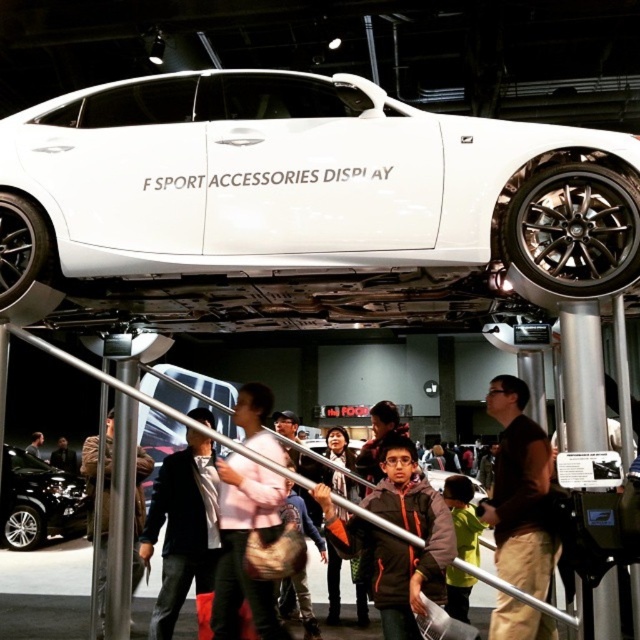
Does shiny black car at center have a greater height compared to dark brown leather jacket at lower center?

Correct, shiny black car at center is much taller as dark brown leather jacket at lower center.

Which is below, shiny black car at center or dark brown leather jacket at lower center?

dark brown leather jacket at lower center

The image size is (640, 640). Describe the element at coordinates (36, 500) in the screenshot. I see `shiny black car at center` at that location.

Find the location of a particular element. shiny black car at center is located at coordinates 36,500.

Does light pink fabric jacket at center appear over brown leather jacket at center?

Yes.

Who is more distant from viewer, (284, 460) or (90, 522)?

The point (90, 522) is more distant.

Between point (244, 428) and point (144, 506), which one is positioned behind?

The point (144, 506) is behind.

Where is `light pink fabric jacket at center`? This screenshot has width=640, height=640. light pink fabric jacket at center is located at coordinates (244, 545).

Who is positioned more to the right, orange fleece jacket at center or shiny black car at center?

orange fleece jacket at center

What do you see at coordinates (397, 538) in the screenshot?
I see `orange fleece jacket at center` at bounding box center [397, 538].

What are the coordinates of `orange fleece jacket at center` in the screenshot? It's located at (397, 538).